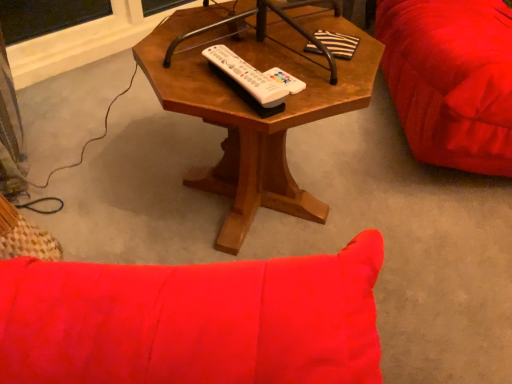
You are a GUI agent. You are given a task and a screenshot of the screen. Output one action in this format:
    pyautogui.click(x=<x>, y=<y>)
    Task: Click on the vacant space underneath wooden hexagonal table at center (from a real-world perspective)
    This screenshot has width=512, height=384.
    Given the screenshot: What is the action you would take?
    pyautogui.click(x=256, y=210)